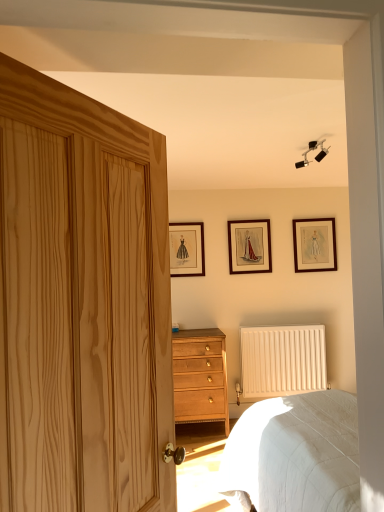
Question: Is wooden picture frame at upper right, the first picture frame from the right, positioned in front of white quilted bed at lower right?

Choices:
 (A) yes
 (B) no

Answer: (B)

Question: Is wooden picture frame at upper right, the first picture frame from the right, turned away from white quilted bed at lower right?

Choices:
 (A) no
 (B) yes

Answer: (A)

Question: From the image's perspective, does wooden picture frame at upper right, the first picture frame from the right, appear higher than white quilted bed at lower right?

Choices:
 (A) no
 (B) yes

Answer: (B)

Question: Is the position of wooden picture frame at upper right, the third picture frame from the left, more distant than that of white quilted bed at lower right?

Choices:
 (A) yes
 (B) no

Answer: (A)

Question: Is there a large distance between wooden picture frame at upper right, the first picture frame from the right, and white quilted bed at lower right?

Choices:
 (A) yes
 (B) no

Answer: (A)

Question: From a real-world perspective, is wooden picture frame at upper right, the first picture frame from the right, physically located above or below matte black picture frame at center, which is the second picture frame in right-to-left order?

Choices:
 (A) below
 (B) above

Answer: (A)

Question: In the image, is wooden picture frame at upper right, the third picture frame from the left, positioned in front of or behind matte black picture frame at center, the second picture frame positioned from the left?

Choices:
 (A) behind
 (B) front

Answer: (A)

Question: Is point (314, 234) positioned closer to the camera than point (241, 248)?

Choices:
 (A) farther
 (B) closer

Answer: (A)

Question: In terms of width, does wooden picture frame at upper right, the third picture frame from the left, look wider or thinner when compared to matte black picture frame at center, which is the second picture frame in right-to-left order?

Choices:
 (A) thin
 (B) wide

Answer: (B)

Question: Considering their positions, is matte black picture frame at center, which is the second picture frame in right-to-left order, located in front of or behind white matte radiator at lower center?

Choices:
 (A) front
 (B) behind

Answer: (B)

Question: From the image's perspective, is matte black picture frame at center, the second picture frame positioned from the left, located above or below white matte radiator at lower center?

Choices:
 (A) above
 (B) below

Answer: (A)

Question: Considering the positions of matte black picture frame at center, the second picture frame positioned from the left, and white matte radiator at lower center in the image, is matte black picture frame at center, the second picture frame positioned from the left, bigger or smaller than white matte radiator at lower center?

Choices:
 (A) big
 (B) small

Answer: (B)

Question: Looking at their shapes, would you say matte black picture frame at center, the second picture frame positioned from the left, is wider or thinner than white matte radiator at lower center?

Choices:
 (A) wide
 (B) thin

Answer: (B)

Question: From a real-world perspective, relative to light wood/texture chest of drawers at center, is white quilted bed at lower right vertically above or below?

Choices:
 (A) above
 (B) below

Answer: (B)

Question: Relative to light wood/texture chest of drawers at center, is white quilted bed at lower right in front or behind?

Choices:
 (A) behind
 (B) front

Answer: (B)